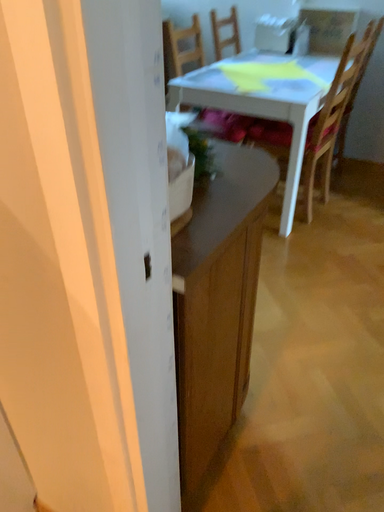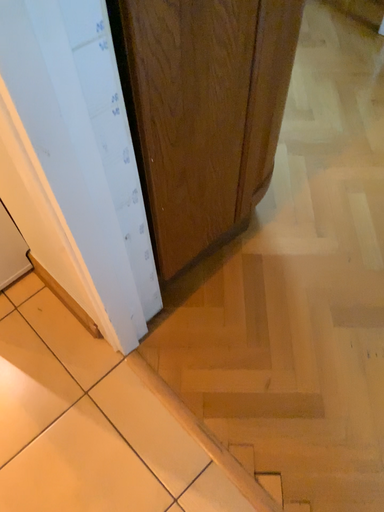
Question: How did the camera likely rotate when shooting the video?

Choices:
 (A) rotated left
 (B) rotated right

Answer: (A)